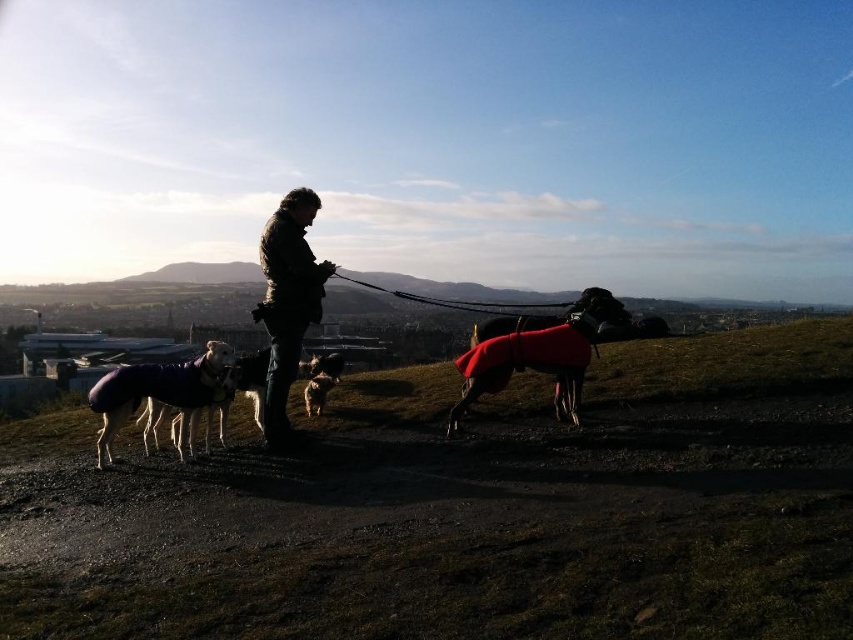
Question: Which object appears farthest from the camera in this image?

Choices:
 (A) shiny black dog at center
 (B) dark brown leather jacket at center
 (C) soft purple coat at lower left

Answer: (A)

Question: Does dark brown leather jacket at center appear on the left side of fluffy brown dog at center?

Choices:
 (A) no
 (B) yes

Answer: (A)

Question: Which object appears farthest from the camera in this image?

Choices:
 (A) velvety red coat at center
 (B) shiny black dog at center
 (C) fluffy brown dog at center
 (D) smooth grass hill at center

Answer: (C)

Question: Does smooth grass hill at center have a smaller size compared to soft purple coat at lower left?

Choices:
 (A) no
 (B) yes

Answer: (A)

Question: Is dark brown leather jacket at center bigger than soft purple coat at lower left?

Choices:
 (A) yes
 (B) no

Answer: (A)

Question: Estimate the real-world distances between objects in this image. Which object is farther from the soft purple coat at lower left?

Choices:
 (A) smooth grass hill at center
 (B) fluffy brown dog at center
 (C) dark brown leather jacket at center

Answer: (A)